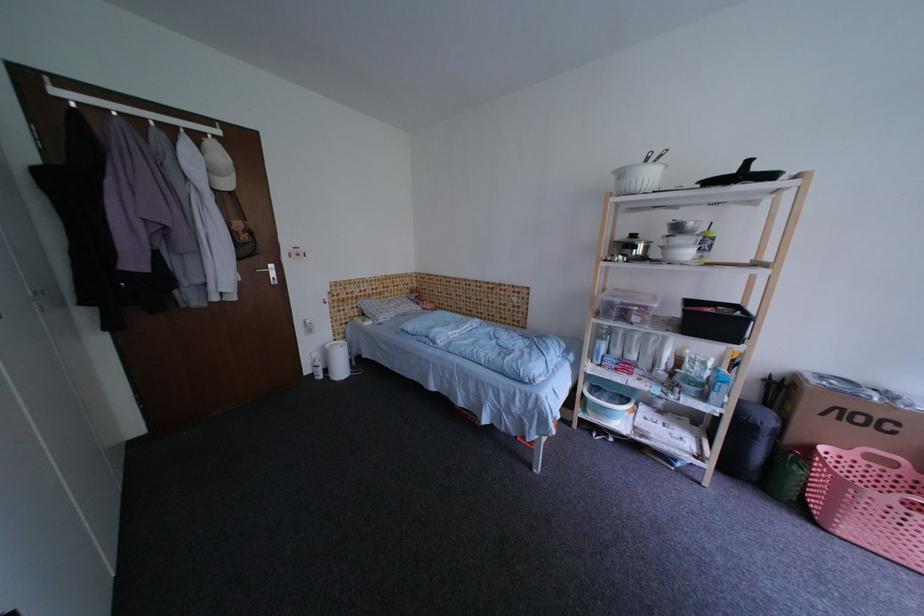
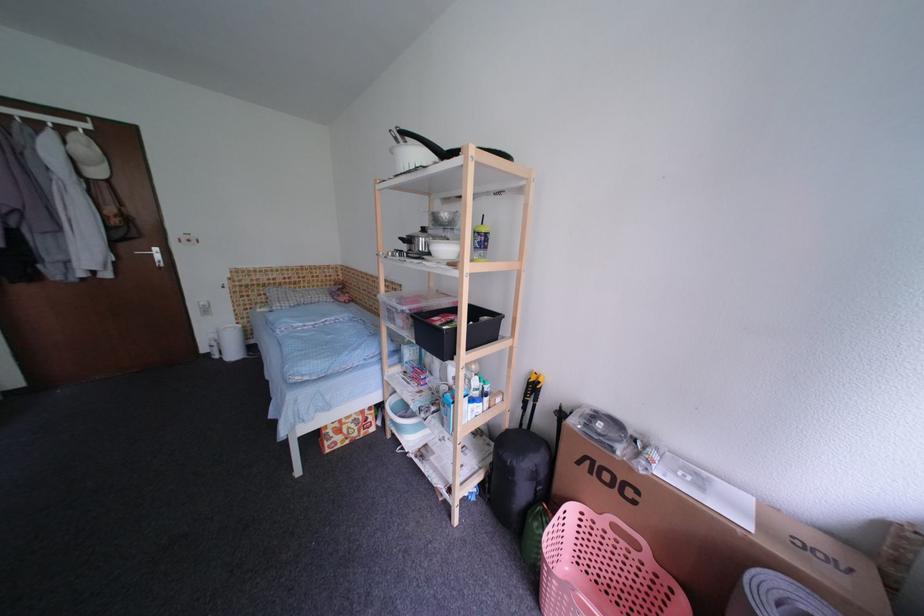
Find the pixel in the second image that matches the point at 324,358 in the first image.

(222, 338)